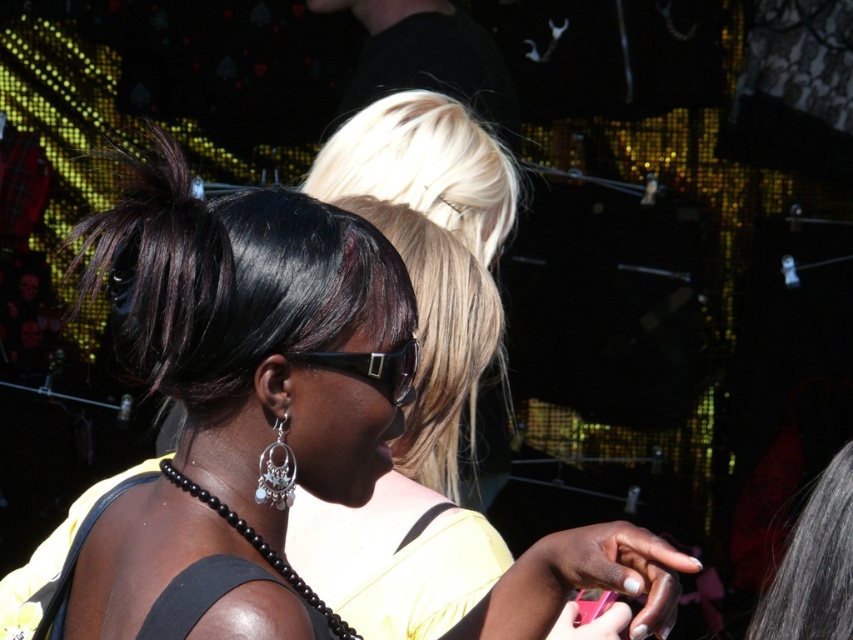
You are at a party and want to take a photo of the silver metallic dangling earring at center without including the gray silky hair at upper right. Is the position of the earring above or below the hair?

The gray silky hair at upper right is below the silver metallic dangling earring at center, so the earring is above the hair. Therefore, you can take the photo focusing on the earring without including the hair by positioning the camera to frame the earring above the gray silky hair at upper right.

You are at a social gathering and want to grab the black plastic sunglasses at center. Where should you look to find them?

The black plastic sunglasses at center are located at point (373, 368).

You are at a social event and notice two items in the distance. You see the gray silky hair at upper right and the silver metallic dangling earring at center. Which of these two items appears taller?

The gray silky hair at upper right has a greater height compared to the silver metallic dangling earring at center, so the gray silky hair at upper right appears taller.